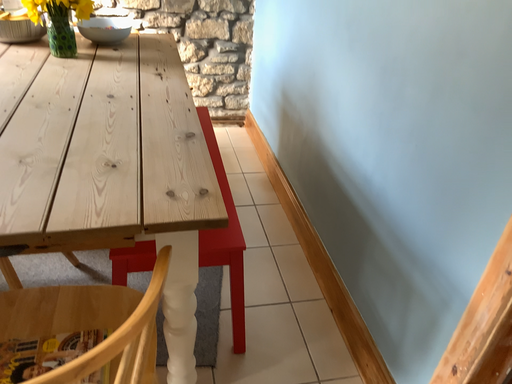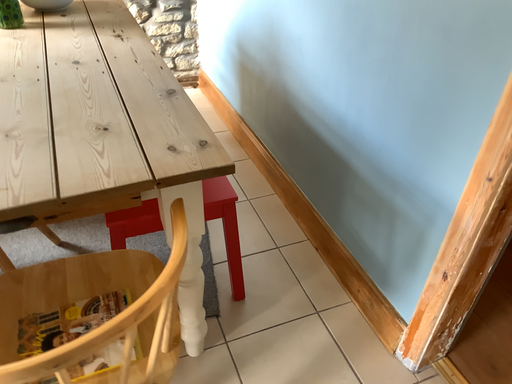
Question: How did the camera likely rotate when shooting the video?

Choices:
 (A) rotated right
 (B) rotated left

Answer: (A)